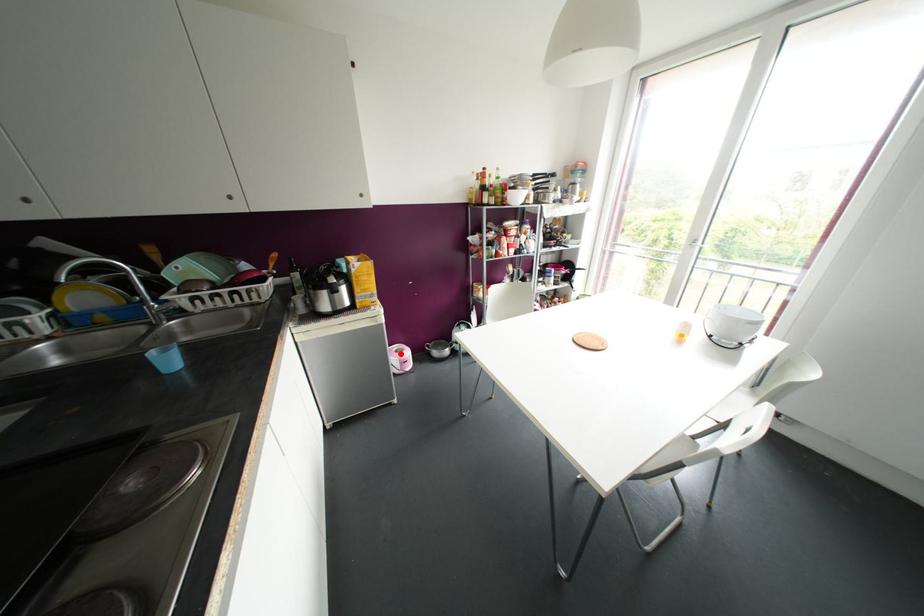
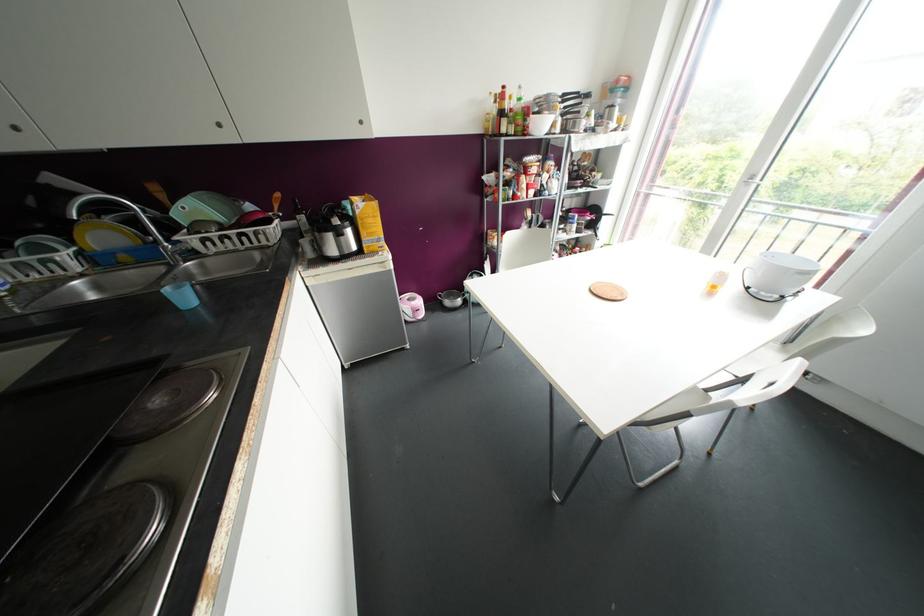
The point at the highlighted location is marked in the first image. Where is the corresponding point in the second image?

(412, 302)